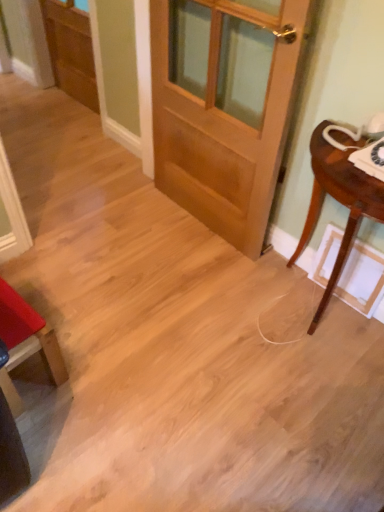
The image size is (384, 512). Identify the location of free space in front of mahogany wood table at right. (308, 406).